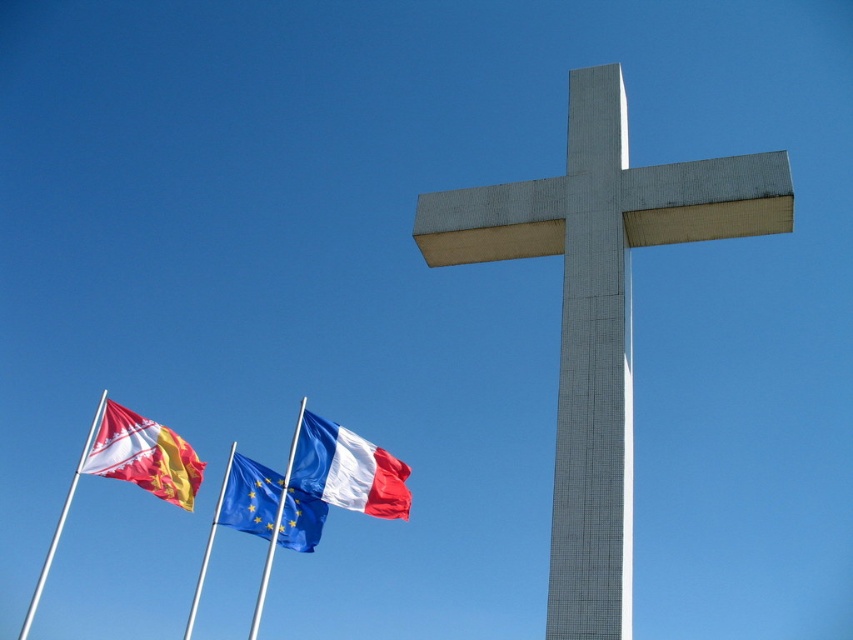
Can you confirm if blue fabric flag at center is bigger than blue fabric flag pole at center?

Incorrect, blue fabric flag at center is not larger than blue fabric flag pole at center.

Does point (245, 529) come farther from viewer compared to point (268, 577)?

No, it is not.

The image size is (853, 640). I want to click on blue fabric flag at center, so click(248, 497).

Does white textured cross at center have a smaller size compared to blue fabric flag pole at center?

Correct, white textured cross at center occupies less space than blue fabric flag pole at center.

Is point (618, 349) positioned in front of point (282, 486)?

Yes, point (618, 349) is in front of point (282, 486).

This screenshot has width=853, height=640. Find the location of `white textured cross at center`. white textured cross at center is located at coordinates (599, 312).

Is point (265, 552) closer to viewer compared to point (219, 508)?

No, (265, 552) is further to viewer.

Describe the element at coordinates (276, 525) in the screenshot. I see `blue fabric flag pole at center` at that location.

Is point (256, 596) positioned in front of point (222, 497)?

No, it is behind (222, 497).

Locate an element on the screen. This screenshot has height=640, width=853. blue fabric flag pole at center is located at coordinates (276, 525).